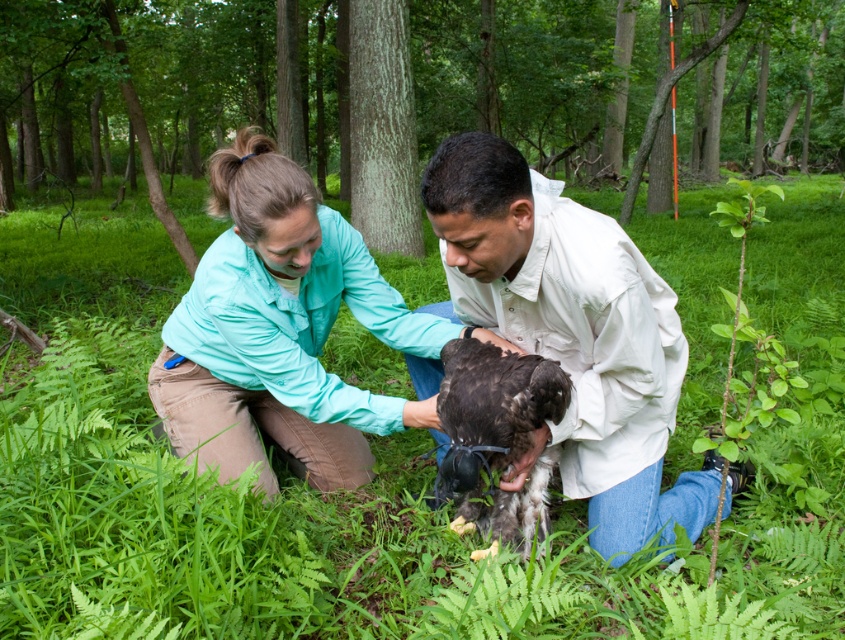
Is green leafy grass at center to the left of white matte shirt at center from the viewer's perspective?

Correct, you'll find green leafy grass at center to the left of white matte shirt at center.

Does green leafy grass at center have a greater height compared to white matte shirt at center?

Yes.

Image resolution: width=845 pixels, height=640 pixels. Identify the location of green leafy grass at center. click(372, 481).

Find the location of a particular element. The width and height of the screenshot is (845, 640). green leafy grass at center is located at coordinates (372, 481).

Does teal fabric shirt at center appear on the left side of dark brown feathered eagle at center?

Correct, you'll find teal fabric shirt at center to the left of dark brown feathered eagle at center.

Does teal fabric shirt at center appear on the right side of dark brown feathered eagle at center?

Incorrect, teal fabric shirt at center is not on the right side of dark brown feathered eagle at center.

What are the coordinates of `teal fabric shirt at center` in the screenshot? It's located at (281, 330).

Is green leafy grass at center positioned at the back of teal fabric shirt at center?

No, it is not.

At what (x,y) coordinates should I click in order to perform the action: click on green leafy grass at center. Please return your answer as a coordinate pair (x, y). Looking at the image, I should click on (372, 481).

Where is `green leafy grass at center`? Image resolution: width=845 pixels, height=640 pixels. green leafy grass at center is located at coordinates click(x=372, y=481).